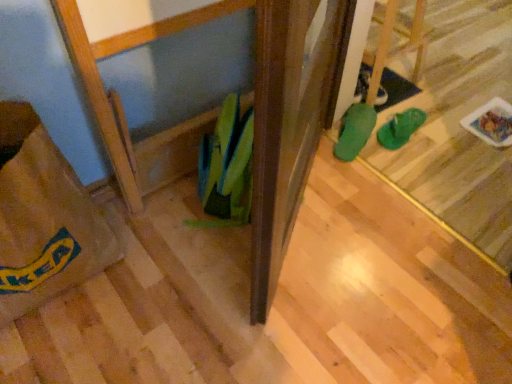
Question: Is green rubber boot at center, marked as the second footwear in a right-to-left arrangement, placed right next to brown paper bag at lower left?

Choices:
 (A) no
 (B) yes

Answer: (A)

Question: Is green rubber boot at center, marked as the second footwear in a right-to-left arrangement, facing towards brown paper bag at lower left?

Choices:
 (A) yes
 (B) no

Answer: (B)

Question: Considering the relative sizes of green rubber boot at center, marked as the second footwear in a right-to-left arrangement, and brown paper bag at lower left in the image provided, is green rubber boot at center, marked as the second footwear in a right-to-left arrangement, smaller than brown paper bag at lower left?

Choices:
 (A) yes
 (B) no

Answer: (A)

Question: Is there a large distance between green rubber boot at center, marked as the second footwear in a right-to-left arrangement, and brown paper bag at lower left?

Choices:
 (A) yes
 (B) no

Answer: (B)

Question: Considering the relative positions of green rubber boot at center, marked as the second footwear in a right-to-left arrangement, and brown paper bag at lower left in the image provided, is green rubber boot at center, marked as the second footwear in a right-to-left arrangement, to the left of brown paper bag at lower left from the viewer's perspective?

Choices:
 (A) yes
 (B) no

Answer: (B)

Question: Considering the relative positions of green rubber boot at center, marked as the second footwear in a right-to-left arrangement, and brown paper bag at lower left in the image provided, is green rubber boot at center, marked as the second footwear in a right-to-left arrangement, behind brown paper bag at lower left?

Choices:
 (A) yes
 (B) no

Answer: (A)

Question: Is green rubber flip-flops at center, the first footwear in the right-to-left sequence, taller than brown paper bag at lower left?

Choices:
 (A) yes
 (B) no

Answer: (B)

Question: Is green rubber flip-flops at center, the first footwear in the right-to-left sequence, further to camera compared to brown paper bag at lower left?

Choices:
 (A) yes
 (B) no

Answer: (A)

Question: From a real-world perspective, is green rubber flip-flops at center, the first footwear in the right-to-left sequence, under brown paper bag at lower left?

Choices:
 (A) yes
 (B) no

Answer: (A)

Question: From the image's perspective, would you say green rubber flip-flops at center, the second footwear when ordered from left to right, is shown under brown paper bag at lower left?

Choices:
 (A) no
 (B) yes

Answer: (A)

Question: From the image's perspective, is green rubber flip-flops at center, the first footwear in the right-to-left sequence, on brown paper bag at lower left?

Choices:
 (A) no
 (B) yes

Answer: (B)

Question: Does green rubber flip-flops at center, the first footwear in the right-to-left sequence, contain brown paper bag at lower left?

Choices:
 (A) no
 (B) yes

Answer: (A)

Question: From the image's perspective, is brown paper bag at lower left on green rubber boot at center, placed as the first footwear when sorted from left to right?

Choices:
 (A) yes
 (B) no

Answer: (B)